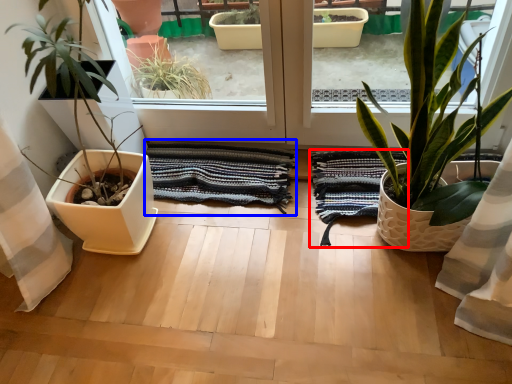
Question: Among these objects, which one is nearest to the camera, bath towel (highlighted by a red box) or bath towel (highlighted by a blue box)?

Choices:
 (A) bath towel
 (B) bath towel

Answer: (A)